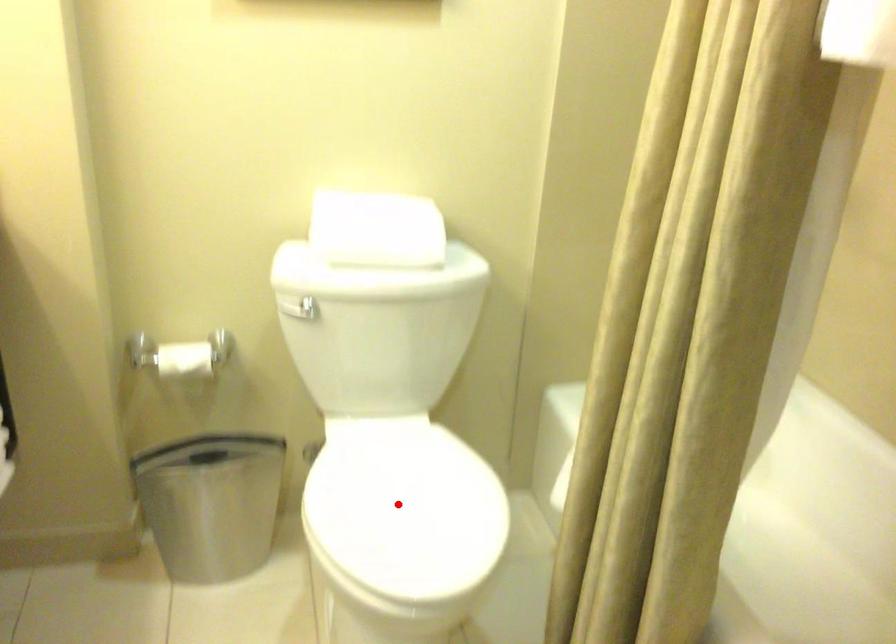
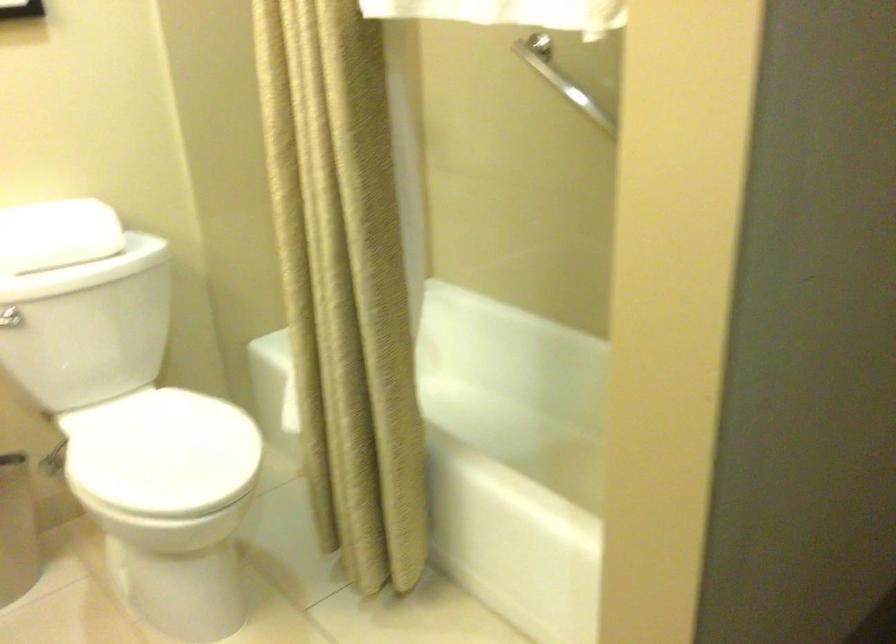
Where in the second image is the point corresponding to the highlighted location from the first image?

(161, 453)